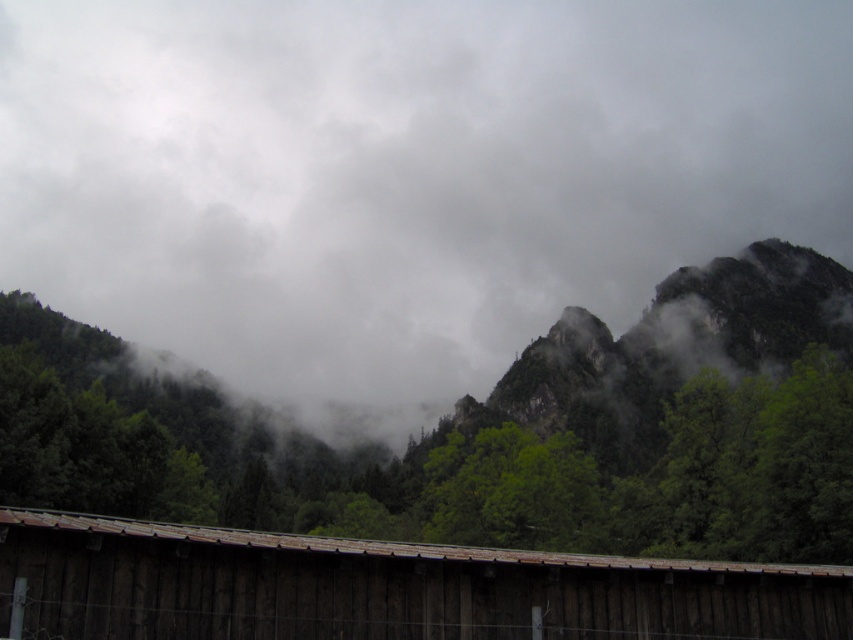
Question: Is brown wooden hut at lower center below green rocky mountain at center?

Choices:
 (A) no
 (B) yes

Answer: (B)

Question: Can you confirm if green matte tree at center is thinner than brown wooden hut at lower center?

Choices:
 (A) no
 (B) yes

Answer: (A)

Question: Which is nearer to the green rocky mountain at center?

Choices:
 (A) green matte tree at center
 (B) cloudy gray sky at upper center
 (C) brown wooden hut at lower center

Answer: (A)

Question: Estimate the real-world distances between objects in this image. Which object is closer to the cloudy gray sky at upper center?

Choices:
 (A) green rocky mountain at center
 (B) brown wooden hut at lower center

Answer: (A)

Question: Which is nearer to the green rocky mountain at center?

Choices:
 (A) cloudy gray sky at upper center
 (B) green matte tree at center
 (C) brown wooden hut at lower center

Answer: (B)

Question: Can you confirm if cloudy gray sky at upper center is positioned to the left of green matte tree at center?

Choices:
 (A) no
 (B) yes

Answer: (A)